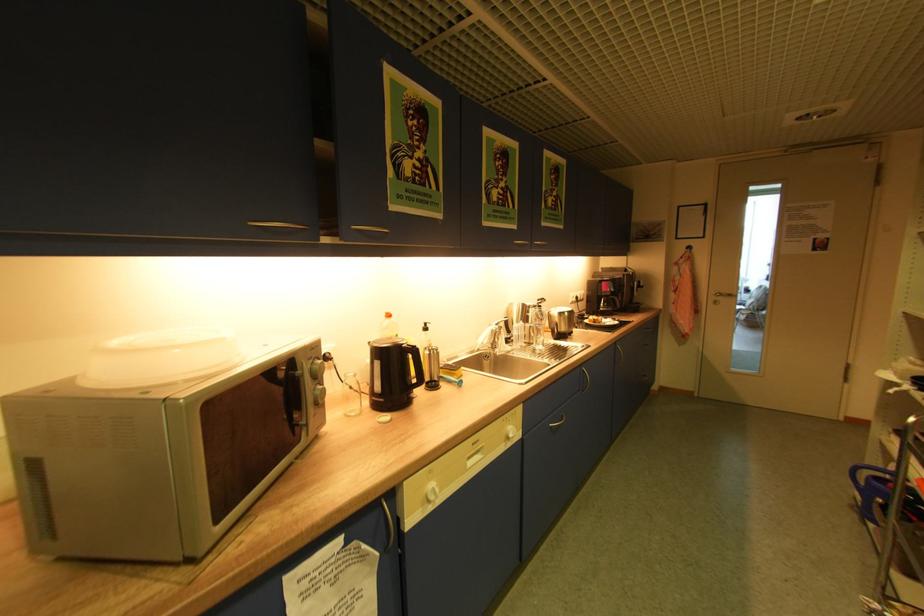
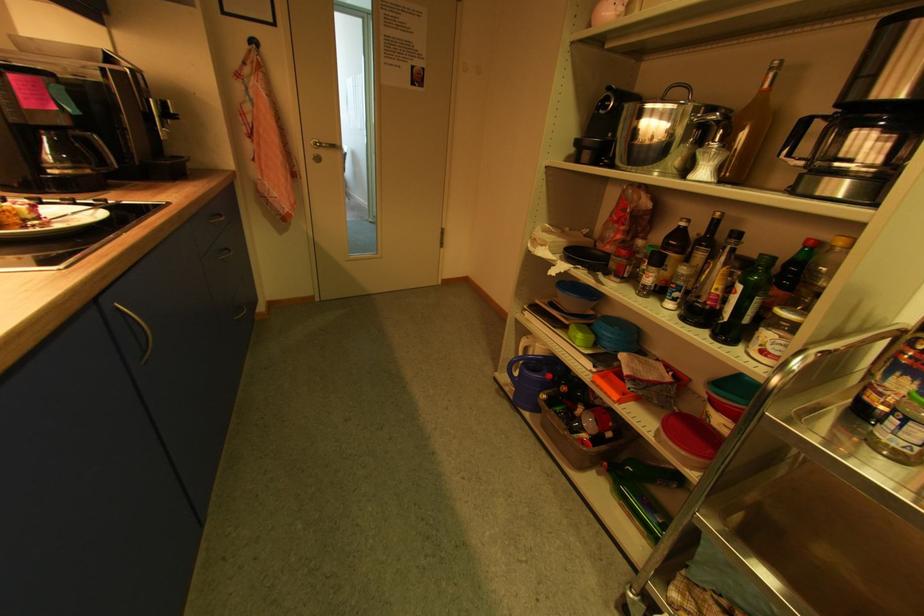
Where in the second image is the point corresponding to point (618, 301) from the first image?

(94, 145)